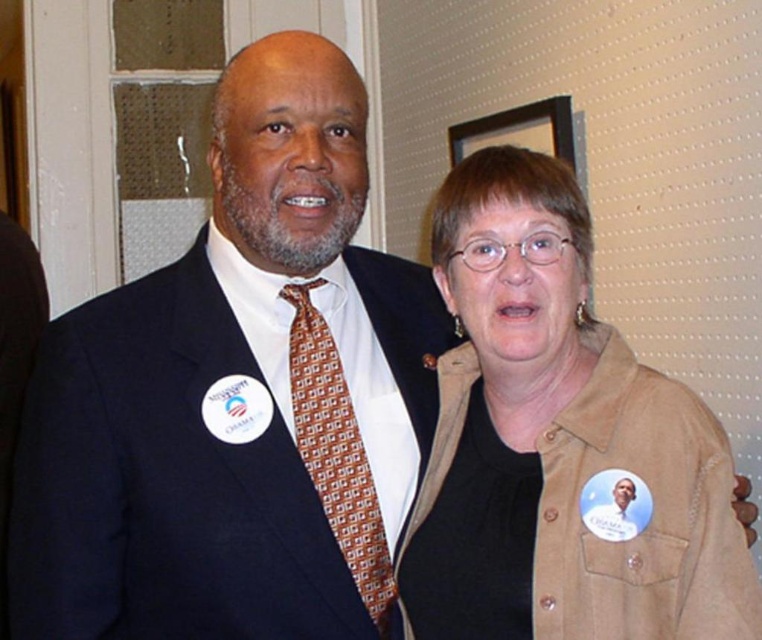
Can you confirm if brown suede jacket at center is positioned above brown silk tie at center?

Indeed, brown suede jacket at center is positioned over brown silk tie at center.

In the scene shown: Who is more forward, (476, 212) or (309, 291)?

Point (476, 212) is in front.

You are a GUI agent. You are given a task and a screenshot of the screen. Output one action in this format:
    pyautogui.click(x=<x>, y=<y>)
    Task: Click on the brown suede jacket at center
    
    Given the screenshot: What is the action you would take?
    pyautogui.click(x=559, y=444)